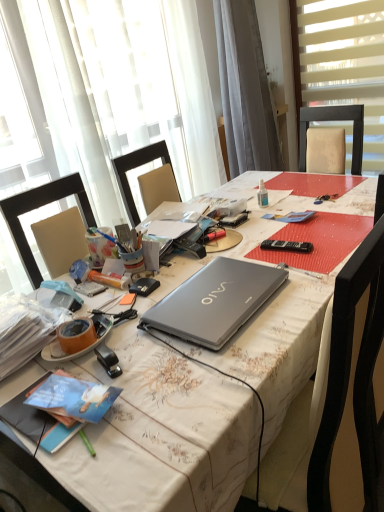
I want to click on free area in between blue paperback book at lower left, the 2th book positioned from the bottom, and black plastic stapler at lower left, so click(100, 375).